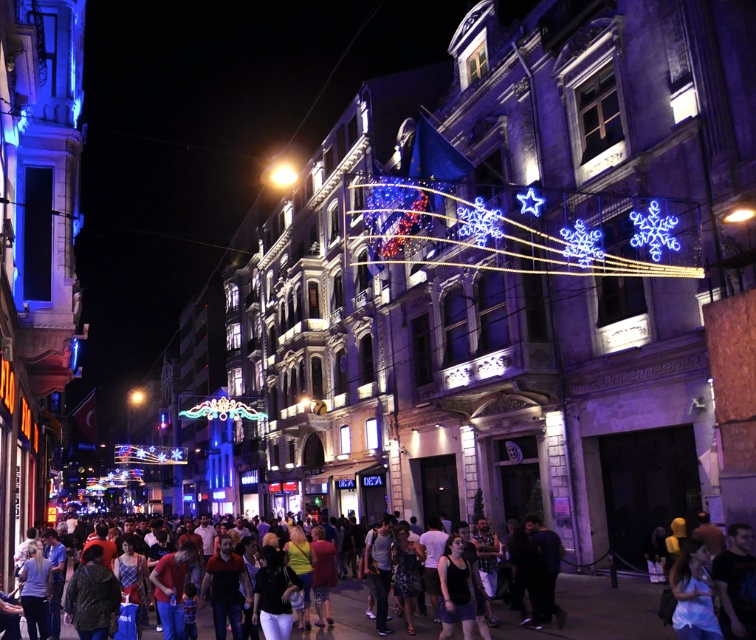
Question: Which object is positioned farthest from the illuminated plastic snowflake at center?

Choices:
 (A) multicolored casual clothing at center
 (B) bright yellow light at center

Answer: (B)

Question: Among these objects, which one is farthest from the camera?

Choices:
 (A) illuminated plastic snowflake at center
 (B) multicolored casual clothing at center

Answer: (A)

Question: Can you confirm if illuminated plastic snowflake at center is positioned below multicolored casual clothing at center?

Choices:
 (A) yes
 (B) no

Answer: (B)

Question: Does multicolored casual clothing at center appear on the left side of bright yellow light at center?

Choices:
 (A) yes
 (B) no

Answer: (B)

Question: Among these points, which one is nearest to the camera?

Choices:
 (A) (507, 611)
 (B) (290, 179)

Answer: (A)

Question: Is illuminated plastic snowflake at center in front of multicolored casual clothing at center?

Choices:
 (A) yes
 (B) no

Answer: (B)